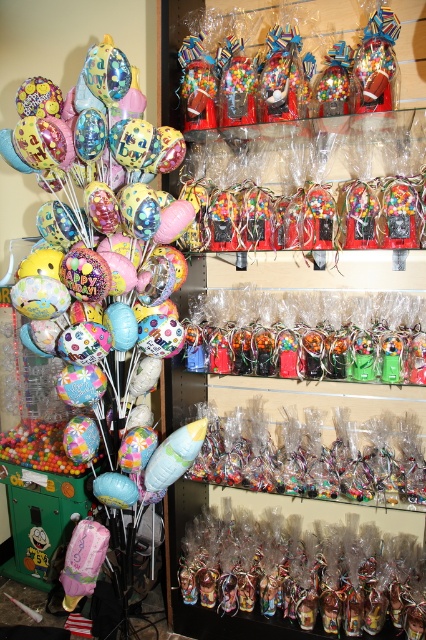
Describe the element at coordinates (97, 234) in the screenshot. I see `matte pastel balloons at left` at that location.

Locate an element on the screen. This screenshot has height=640, width=426. matte pastel balloons at left is located at coordinates (97, 234).